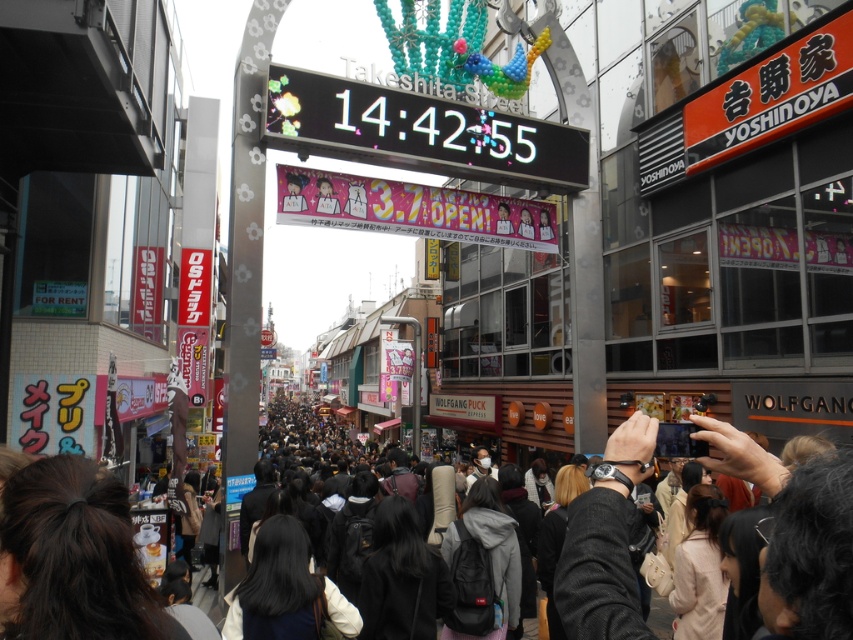
Does dark brown hair at lower left appear on the right side of black matte backpack at center?

In fact, dark brown hair at lower left is to the left of black matte backpack at center.

The image size is (853, 640). Find the location of `dark brown hair at lower left`. dark brown hair at lower left is located at coordinates (73, 557).

At what (x,y) coordinates should I click in order to perform the action: click on dark brown hair at lower left. Please return your answer as a coordinate pair (x, y). This screenshot has height=640, width=853. Looking at the image, I should click on (73, 557).

Based on the photo, does dark brown hair at lower left appear under black matte hair at center?

Actually, dark brown hair at lower left is above black matte hair at center.

Between dark brown hair at lower left and black matte hair at center, which one has less height?

dark brown hair at lower left is shorter.

You are a GUI agent. You are given a task and a screenshot of the screen. Output one action in this format:
    pyautogui.click(x=<x>, y=<y>)
    Task: Click on the dark brown hair at lower left
    This screenshot has width=853, height=640.
    Given the screenshot: What is the action you would take?
    pyautogui.click(x=73, y=557)

How far apart are black fabric camera at center and black hair at center?

black fabric camera at center and black hair at center are 17.99 meters apart from each other.

Which is in front, point (592, 525) or point (253, 588)?

Point (592, 525)

Which is in front, point (729, 428) or point (233, 604)?

Point (729, 428) is in front.

Locate an element on the screen. The image size is (853, 640). black fabric camera at center is located at coordinates (798, 531).